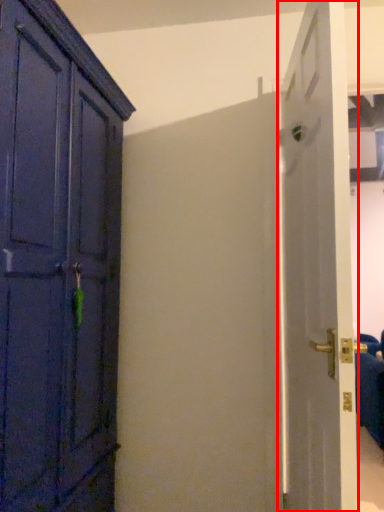
Question: From the image's perspective, what is the correct spatial positioning of door (annotated by the red box) in reference to furniture?

Choices:
 (A) below
 (B) above

Answer: (B)